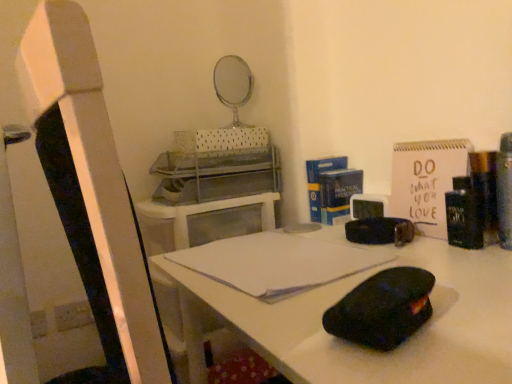
Question: Based on their positions, is white paper notebook at center located to the left or right of black matte desk at center?

Choices:
 (A) left
 (B) right

Answer: (A)

Question: In terms of size, does white paper notebook at center appear bigger or smaller than black matte desk at center?

Choices:
 (A) small
 (B) big

Answer: (A)

Question: Considering the positions of point (305, 279) and point (466, 382), is point (305, 279) closer or farther from the camera than point (466, 382)?

Choices:
 (A) closer
 (B) farther

Answer: (B)

Question: From a real-world perspective, relative to white paper notebook at center, is black matte desk at center vertically above or below?

Choices:
 (A) below
 (B) above

Answer: (A)

Question: Visually, is black matte desk at center positioned to the left or to the right of white paper notebook at center?

Choices:
 (A) left
 (B) right

Answer: (B)

Question: Is point (505, 372) closer or farther from the camera than point (266, 231)?

Choices:
 (A) closer
 (B) farther

Answer: (A)

Question: In terms of height, does black matte desk at center look taller or shorter compared to white paper notebook at center?

Choices:
 (A) short
 (B) tall

Answer: (B)